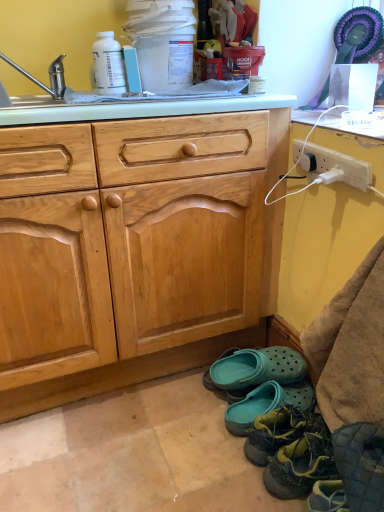
Question: Is white plastic power outlet at right facing towards white plastic bottle at upper left?

Choices:
 (A) no
 (B) yes

Answer: (A)

Question: Is white plastic bottle at upper left surrounded by white plastic power outlet at right?

Choices:
 (A) yes
 (B) no

Answer: (B)

Question: Does white plastic power outlet at right lie in front of white plastic bottle at upper left?

Choices:
 (A) no
 (B) yes

Answer: (B)

Question: Is white plastic bottle at upper left at the back of white plastic power outlet at right?

Choices:
 (A) no
 (B) yes

Answer: (A)

Question: Can you confirm if white plastic power outlet at right is shorter than white plastic bottle at upper left?

Choices:
 (A) no
 (B) yes

Answer: (B)

Question: From a real-world perspective, is white glossy countertop at upper right positioned above or below white plastic bottle at upper left?

Choices:
 (A) above
 (B) below

Answer: (B)

Question: Considering the relative positions of white glossy countertop at upper right and white plastic bottle at upper left in the image provided, is white glossy countertop at upper right to the left or to the right of white plastic bottle at upper left?

Choices:
 (A) right
 (B) left

Answer: (A)

Question: Is point (382, 121) positioned closer to the camera than point (100, 54)?

Choices:
 (A) closer
 (B) farther

Answer: (A)

Question: From the image's perspective, is white glossy countertop at upper right above or below white plastic bottle at upper left?

Choices:
 (A) below
 (B) above

Answer: (A)

Question: From the image's perspective, is teal rubber clogs at lower center, which appears as the first footwear when viewed from the back, above or below white glossy countertop at upper right?

Choices:
 (A) above
 (B) below

Answer: (B)

Question: Is teal rubber clogs at lower center, which is counted as the 4th footwear, starting from the front, in front of or behind white glossy countertop at upper right in the image?

Choices:
 (A) behind
 (B) front

Answer: (A)

Question: In terms of size, does teal rubber clogs at lower center, which appears as the first footwear when viewed from the back, appear bigger or smaller than white glossy countertop at upper right?

Choices:
 (A) small
 (B) big

Answer: (B)

Question: Visually, is teal rubber clogs at lower center, which is counted as the 4th footwear, starting from the front, positioned to the left or to the right of white glossy countertop at upper right?

Choices:
 (A) right
 (B) left

Answer: (B)

Question: Based on their positions, is brushed metal faucet at upper left located to the left or right of white plastic power outlet at right?

Choices:
 (A) left
 (B) right

Answer: (A)

Question: From the image's perspective, relative to white plastic power outlet at right, is brushed metal faucet at upper left above or below?

Choices:
 (A) above
 (B) below

Answer: (A)